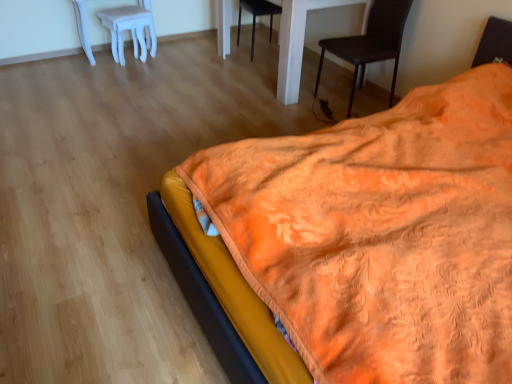
Where is `vacant position to the left of white glossy table at center`? The height and width of the screenshot is (384, 512). vacant position to the left of white glossy table at center is located at coordinates (182, 76).